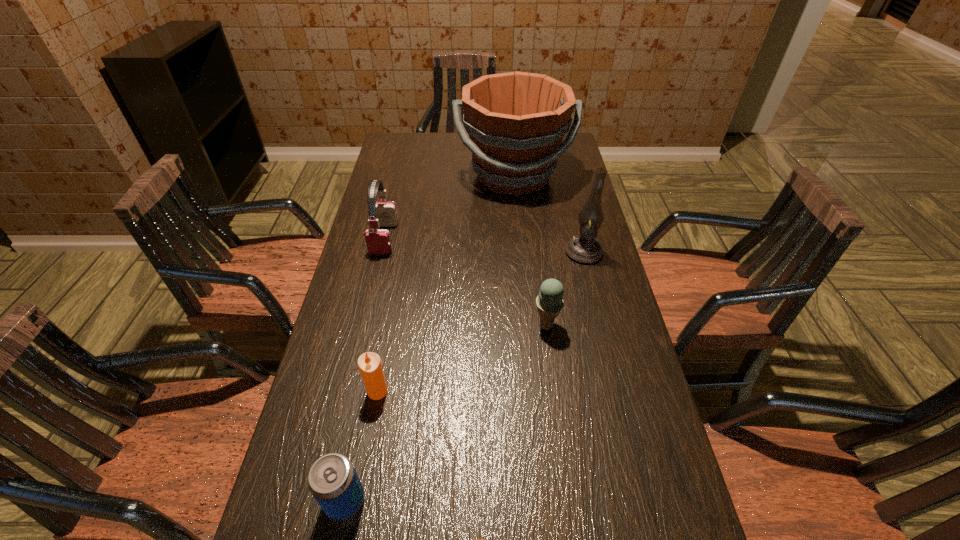
This screenshot has height=540, width=960. Identify the location of the farthest object. (516, 121).

This screenshot has width=960, height=540. I want to click on oil lamp, so click(x=584, y=248).

At what (x,y) coordinates should I click in order to perform the action: click on earphone. Please return your answer as a coordinate pair (x, y). Looking at the image, I should click on (378, 241).

At what (x,y) coordinates should I click in order to perform the action: click on the fourth nearest object. Please return your answer as a coordinate pair (x, y). Looking at the image, I should click on point(549,302).

Locate an element on the screen. The image size is (960, 540). the fifth farthest object is located at coordinates (369, 364).

At what (x,y) coordinates should I click in order to perform the action: click on the second nearest object. Please return your answer as a coordinate pair (x, y). The height and width of the screenshot is (540, 960). Looking at the image, I should click on (332, 480).

Identify the location of vacant region located 0.370m on the handle side of the farthest object. This screenshot has width=960, height=540. (524, 284).

Where is `free location located on the back of the oil lamp`? The width and height of the screenshot is (960, 540). free location located on the back of the oil lamp is located at coordinates (576, 221).

You are a GUI agent. You are given a task and a screenshot of the screen. Output one action in this format:
    pyautogui.click(x=<x>, y=<y>)
    Task: Click on the vacant space located on the outer surface of the earphone
    The width and height of the screenshot is (960, 540).
    Given the screenshot: What is the action you would take?
    pyautogui.click(x=374, y=280)

The image size is (960, 540). What are the coordinates of `vacant space situated on the back of the fourth nearest object` in the screenshot? It's located at (540, 277).